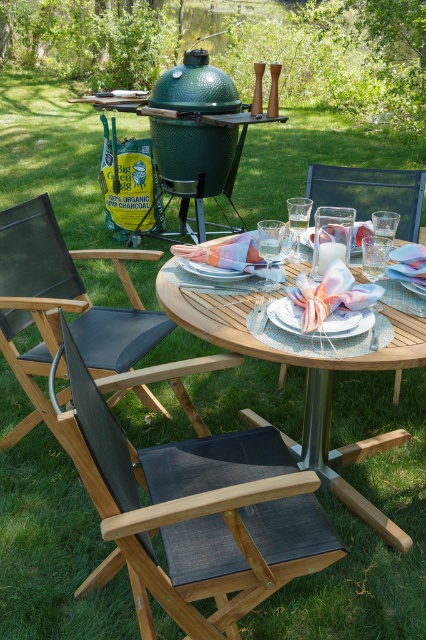
Measure the distance from black fabric chair at lower left to black fabric chair at center.

black fabric chair at lower left and black fabric chair at center are 3.92 feet apart.

Between point (100, 324) and point (330, 195), which one is positioned in front?

Point (100, 324) is more forward.

Locate an element on the screen. The image size is (426, 640). black fabric chair at lower left is located at coordinates (63, 307).

Who is taller, dark gray fabric folding chair at lower left or wooden table at center?

Standing taller between the two is dark gray fabric folding chair at lower left.

Which is more to the right, dark gray fabric folding chair at lower left or wooden table at center?

From the viewer's perspective, wooden table at center appears more on the right side.

Which is behind, point (201, 509) or point (393, 340)?

Point (393, 340)

Image resolution: width=426 pixels, height=640 pixels. What are the coordinates of `dark gray fabric folding chair at lower left` in the screenshot? It's located at (198, 512).

Measure the distance between dark gray fabric folding chair at lower left and pastel fabric napkin at center.

dark gray fabric folding chair at lower left is 53.55 centimeters from pastel fabric napkin at center.

Is point (244, 506) positioned behind point (327, 321)?

No, it is in front of (327, 321).

You are a GUI agent. You are given a task and a screenshot of the screen. Output one action in this format:
    pyautogui.click(x=<x>, y=<y>)
    Task: Click on the dark gray fabric folding chair at lower left
    
    Given the screenshot: What is the action you would take?
    pyautogui.click(x=198, y=512)